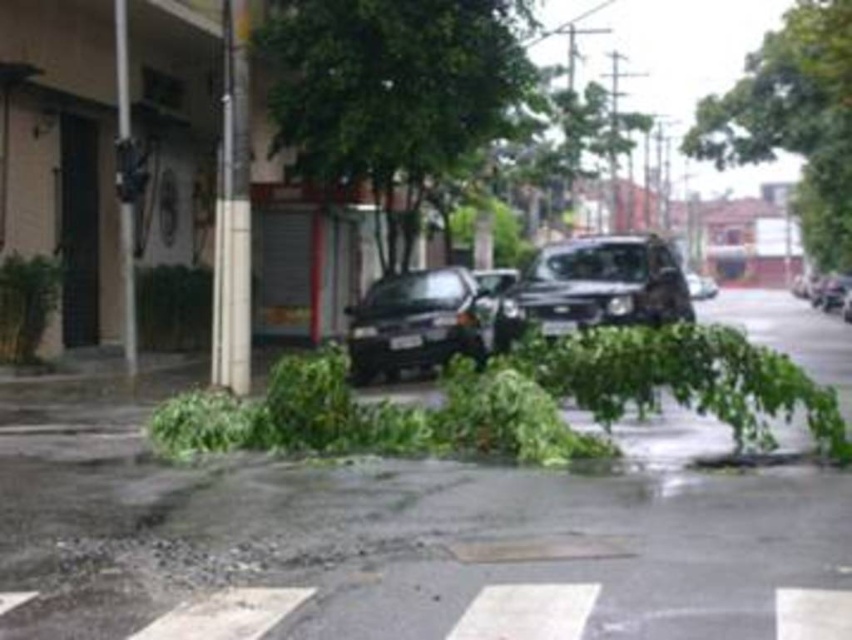
Question: Which point is closer to the camera taking this photo?

Choices:
 (A) (816, 65)
 (B) (421, 300)
 (C) (395, 147)
 (D) (832, 275)

Answer: (B)

Question: Which object is closer to the camera taking this photo?

Choices:
 (A) green leafy tree at upper right
 (B) glossy black car at center
 (C) green leafy tree at center

Answer: (B)

Question: Which object is positioned farthest from the glossy black car at center?

Choices:
 (A) satin black suv at center
 (B) shiny black car at right
 (C) green leafy tree at center

Answer: (B)

Question: Considering the relative positions of green leafy tree at upper right and shiny black car at right in the image provided, where is green leafy tree at upper right located with respect to shiny black car at right?

Choices:
 (A) left
 (B) right

Answer: (A)

Question: Can you confirm if green leafy tree at upper right is thinner than shiny black car at right?

Choices:
 (A) no
 (B) yes

Answer: (A)

Question: Does glossy black car at center have a larger size compared to shiny black car at right?

Choices:
 (A) yes
 (B) no

Answer: (B)